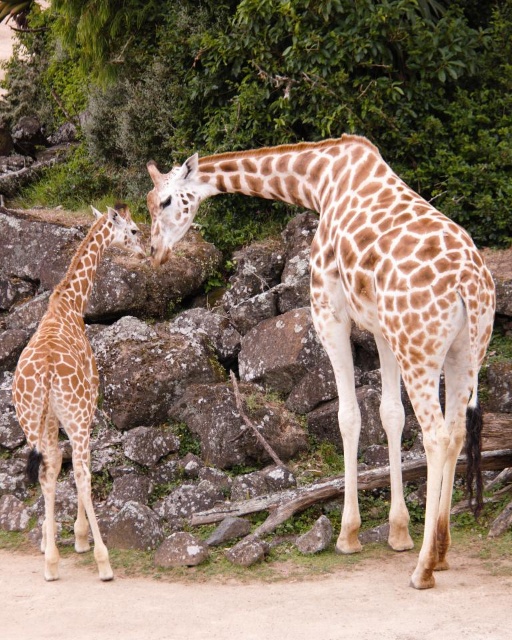
You are a zookeeper observing the giraffes and need to place a feeding station between the green leafy tree at upper center and the brown spotted giraffe at left. Based on their positions, which side of the giraffe should the feeding station be placed on?

The green leafy tree at upper center is positioned on the right side of the brown spotted giraffe at left. Therefore, the feeding station should be placed to the right of the brown spotted giraffe at left to be between them.

You are a zookeeper observing the giraffes and the tree in the enclosure. From your vantage point, which object is closer to you between the green leafy tree at upper center and the brown spotted giraffe at center?

The green leafy tree at upper center is closer to you than the brown spotted giraffe at center.

You are a zookeeper observing two brown spotted giraffes in their enclosure. You notice the brown spotted giraffe at center and the brown spotted giraffe at left. Which giraffe is closer to you?

The brown spotted giraffe at center is closer to you because it is in front of the brown spotted giraffe at left, indicating it is positioned nearer in the enclosure.